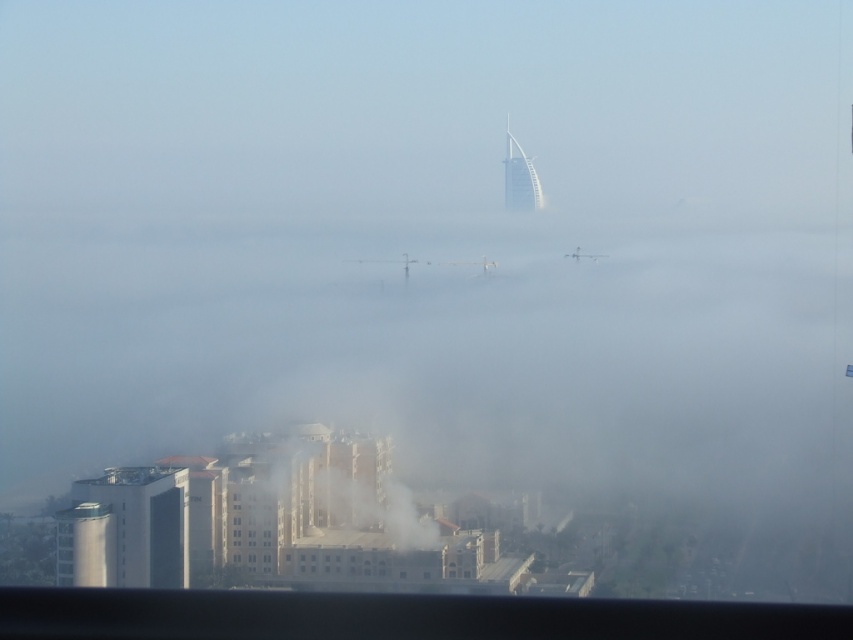
Looking at this image, which is above, white smoke at center or white glass tower at upper center?

Positioned higher is white glass tower at upper center.

Is white smoke at center smaller than white glass tower at upper center?

No, white smoke at center is not smaller than white glass tower at upper center.

Which is in front, point (363, 524) or point (509, 180)?

Point (509, 180) is in front.

At what (x,y) coordinates should I click in order to perform the action: click on white smoke at center. Please return your answer as a coordinate pair (x, y). Looking at the image, I should click on (378, 515).